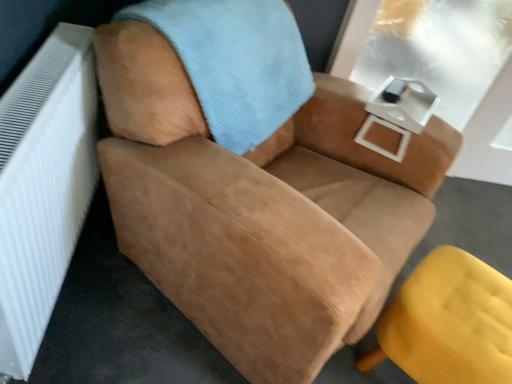
Question: Could white textured radiator at left be considered to be inside white glossy table at upper right?

Choices:
 (A) no
 (B) yes

Answer: (A)

Question: From a real-world perspective, is white glossy table at upper right located beneath white textured radiator at left?

Choices:
 (A) no
 (B) yes

Answer: (A)

Question: From a real-world perspective, is white glossy table at upper right located higher than white textured radiator at left?

Choices:
 (A) no
 (B) yes

Answer: (B)

Question: From the image's perspective, is white glossy table at upper right beneath white textured radiator at left?

Choices:
 (A) no
 (B) yes

Answer: (A)

Question: Does white glossy table at upper right have a lesser height compared to white textured radiator at left?

Choices:
 (A) no
 (B) yes

Answer: (B)

Question: Is white textured radiator at left wider or thinner than matte yellow ottoman at lower right, which is the 2th chair from top to bottom?

Choices:
 (A) thin
 (B) wide

Answer: (A)

Question: Does point (10, 311) appear closer or farther from the camera than point (448, 251)?

Choices:
 (A) closer
 (B) farther

Answer: (A)

Question: Is white textured radiator at left situated inside matte yellow ottoman at lower right, which is the 2th chair from top to bottom, or outside?

Choices:
 (A) inside
 (B) outside

Answer: (B)

Question: From their relative heights in the image, would you say white textured radiator at left is taller or shorter than matte yellow ottoman at lower right, which is the 2th chair from top to bottom?

Choices:
 (A) short
 (B) tall

Answer: (B)

Question: From their relative heights in the image, would you say suede tan chair at center, the 1th chair in the top-to-bottom sequence, is taller or shorter than light blue corduroy blanket at upper center?

Choices:
 (A) tall
 (B) short

Answer: (A)

Question: Looking at the image, does suede tan chair at center, the second chair from the bottom, seem bigger or smaller compared to light blue corduroy blanket at upper center?

Choices:
 (A) big
 (B) small

Answer: (A)

Question: Is suede tan chair at center, the second chair from the bottom, in front of or behind light blue corduroy blanket at upper center in the image?

Choices:
 (A) behind
 (B) front

Answer: (B)

Question: Does point (170, 129) appear closer or farther from the camera than point (273, 11)?

Choices:
 (A) farther
 (B) closer

Answer: (B)

Question: Is point (476, 344) positioned closer to the camera than point (394, 97)?

Choices:
 (A) closer
 (B) farther

Answer: (A)

Question: From the image's perspective, is matte yellow ottoman at lower right, which is counted as the 1th chair, starting from the bottom, located above or below white glossy table at upper right?

Choices:
 (A) above
 (B) below

Answer: (B)